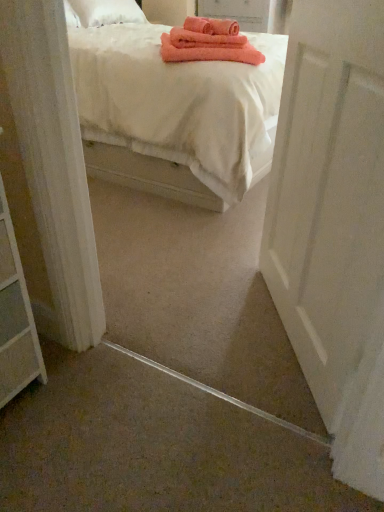
Identify the location of white matte door at right. The width and height of the screenshot is (384, 512). (333, 224).

What do you see at coordinates (333, 224) in the screenshot? This screenshot has height=512, width=384. I see `white matte door at right` at bounding box center [333, 224].

Identify the location of white cotton bed at upper center. (172, 110).

What do you see at coordinates (172, 110) in the screenshot? I see `white cotton bed at upper center` at bounding box center [172, 110].

In order to face white cotton bed at upper center, should I rotate leftwards or rightwards?

To face it directly, rotate left by 4.975 degrees.

You are a GUI agent. You are given a task and a screenshot of the screen. Output one action in this format:
    pyautogui.click(x=<x>, y=<y>)
    Task: Click on the white matte door at right
    This screenshot has height=512, width=384.
    Given the screenshot: What is the action you would take?
    pyautogui.click(x=333, y=224)

Is white cotton bed at upper center at the right side of white matte door at right?

No.

Is the position of white cotton bed at upper center less distant than that of white matte door at right?

No, it is behind white matte door at right.

Considering the positions of point (250, 150) and point (312, 369), is point (250, 150) closer or farther from the camera than point (312, 369)?

Point (250, 150).

From the image's perspective, who appears lower, white cotton bed at upper center or white matte door at right?

white matte door at right.

From a real-world perspective, is white cotton bed at upper center below white matte door at right?

Yes, from a real-world perspective, white cotton bed at upper center is below white matte door at right.

Considering the sizes of objects white cotton bed at upper center and white matte door at right in the image provided, who is thinner, white cotton bed at upper center or white matte door at right?

white matte door at right.

In terms of height, does white cotton bed at upper center look taller or shorter compared to white matte door at right?

white cotton bed at upper center is shorter than white matte door at right.

Which of these two, white cotton bed at upper center or white matte door at right, is bigger?

Bigger between the two is white cotton bed at upper center.

Is white cotton bed at upper center outside of white matte door at right?

white cotton bed at upper center is positioned outside white matte door at right.

Is white cotton bed at upper center not near white matte door at right?

No, white cotton bed at upper center is not far from white matte door at right.

Is white matte door at right at the back of white cotton bed at upper center?

That's not correct — white cotton bed at upper center is not looking away from white matte door at right.

How far apart are white cotton bed at upper center and white matte door at right?

white cotton bed at upper center and white matte door at right are 38.90 inches apart.

Locate an element on the screen. bed on the left side of white matte door at right is located at coordinates (172, 110).

Is white matte door at right at the left side of white cotton bed at upper center?

In fact, white matte door at right is to the right of white cotton bed at upper center.

Is white matte door at right in front of white cotton bed at upper center?

That is True.

Does point (276, 222) appear closer or farther from the camera than point (102, 85)?

Clearly, point (276, 222) is closer to the camera than point (102, 85).

From the image's perspective, which one is positioned lower, white matte door at right or white cotton bed at upper center?

white matte door at right appears lower in the image.

From a real-world perspective, which object stands above the other?

From a 3D spatial view, white matte door at right is above.

Considering the sizes of white matte door at right and white cotton bed at upper center in the image, is white matte door at right wider or thinner than white cotton bed at upper center?

In the image, white matte door at right appears to be more narrow than white cotton bed at upper center.

Considering the relative sizes of white matte door at right and white cotton bed at upper center in the image provided, is white matte door at right shorter than white cotton bed at upper center?

In fact, white matte door at right may be taller than white cotton bed at upper center.

Does white matte door at right have a smaller size compared to white cotton bed at upper center?

Indeed, white matte door at right has a smaller size compared to white cotton bed at upper center.

Would you say white matte door at right is inside or outside white cotton bed at upper center?

white matte door at right is outside white cotton bed at upper center.

Would you say white matte door at right is a long distance from white cotton bed at upper center?

They are positioned close to each other.

Is white matte door at right looking in the opposite direction of white cotton bed at upper center?

No, white matte door at right's orientation is not away from white cotton bed at upper center.

The image size is (384, 512). Find the location of `bed lying on the left of white matte door at right`. bed lying on the left of white matte door at right is located at coordinates (172, 110).

Where is `bed located above the white matte door at right (from the image's perspective)`? Image resolution: width=384 pixels, height=512 pixels. bed located above the white matte door at right (from the image's perspective) is located at coordinates (172, 110).

Where is `door in front of the white cotton bed at upper center`? door in front of the white cotton bed at upper center is located at coordinates (333, 224).